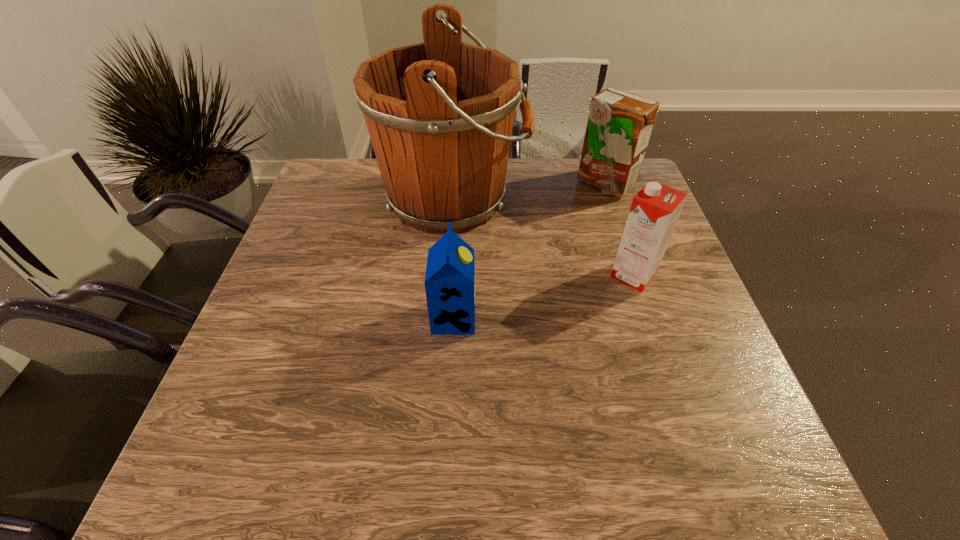
Locate an element on the screen. This screenshot has height=540, width=960. the tallest object is located at coordinates (440, 114).

You are a GUI agent. You are given a task and a screenshot of the screen. Output one action in this format:
    pyautogui.click(x=<x>, y=<y>)
    Task: Click on the farthest carton
    This screenshot has width=960, height=540.
    Given the screenshot: What is the action you would take?
    pyautogui.click(x=619, y=126)

At what (x,y) coordinates should I click in order to perform the action: click on the second nearest object. Please return your answer as a coordinate pair (x, y). This screenshot has width=960, height=540. Looking at the image, I should click on (655, 209).

This screenshot has width=960, height=540. I want to click on the nearest carton, so click(x=449, y=282).

Where is `the nearest object`? The width and height of the screenshot is (960, 540). the nearest object is located at coordinates (449, 282).

The height and width of the screenshot is (540, 960). Identify the location of vacant area located 0.120m with the handle on the side of the tallest object. (568, 199).

You are a GUI agent. You are given a task and a screenshot of the screen. Output one action in this format:
    pyautogui.click(x=<x>, y=<y>)
    Task: Click on the vacant space located 0.080m on the straw side of the farthest carton
    
    Given the screenshot: What is the action you would take?
    pyautogui.click(x=616, y=218)

I want to click on vacant space situated 0.060m on the left of the third farthest object, so click(586, 275).

I want to click on blank area located 0.150m with the cap open on the nearest object, so click(x=542, y=318).

Locate an element on the screen. bucket present at the far edge is located at coordinates (440, 114).